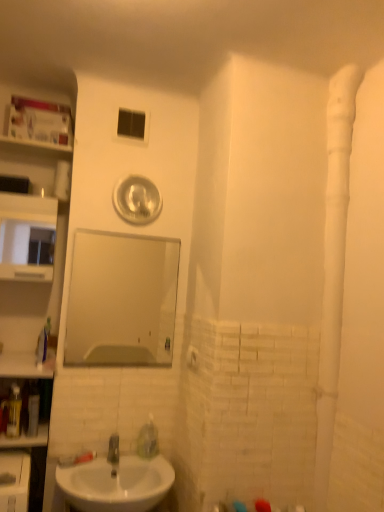
Question: From a real-world perspective, is transparent plastic window at upper center physically below clear glass mirror at center?

Choices:
 (A) yes
 (B) no

Answer: (B)

Question: Is transparent plastic window at upper center facing towards clear glass mirror at center?

Choices:
 (A) yes
 (B) no

Answer: (B)

Question: From a real-world perspective, is transparent plastic window at upper center over clear glass mirror at center?

Choices:
 (A) yes
 (B) no

Answer: (A)

Question: Is transparent plastic window at upper center completely or partially outside of clear glass mirror at center?

Choices:
 (A) yes
 (B) no

Answer: (A)

Question: From the image's perspective, would you say transparent plastic window at upper center is shown under clear glass mirror at center?

Choices:
 (A) yes
 (B) no

Answer: (B)

Question: Does transparent plastic window at upper center have a larger size compared to clear glass mirror at center?

Choices:
 (A) no
 (B) yes

Answer: (A)

Question: Is translucent plastic bottle at left shorter than transparent plastic window at upper center?

Choices:
 (A) no
 (B) yes

Answer: (A)

Question: Does translucent plastic bottle at left have a greater width compared to transparent plastic window at upper center?

Choices:
 (A) no
 (B) yes

Answer: (B)

Question: Considering the relative sizes of translucent plastic bottle at left and transparent plastic window at upper center in the image provided, is translucent plastic bottle at left smaller than transparent plastic window at upper center?

Choices:
 (A) no
 (B) yes

Answer: (B)

Question: From the image's perspective, is translucent plastic bottle at left beneath transparent plastic window at upper center?

Choices:
 (A) no
 (B) yes

Answer: (B)

Question: Is translucent plastic bottle at left outside of transparent plastic window at upper center?

Choices:
 (A) yes
 (B) no

Answer: (A)

Question: Is translucent plastic bottle at left behind transparent plastic window at upper center?

Choices:
 (A) no
 (B) yes

Answer: (A)

Question: Does white matte water pipe at right have a lesser height compared to transparent plastic window at upper center?

Choices:
 (A) no
 (B) yes

Answer: (A)